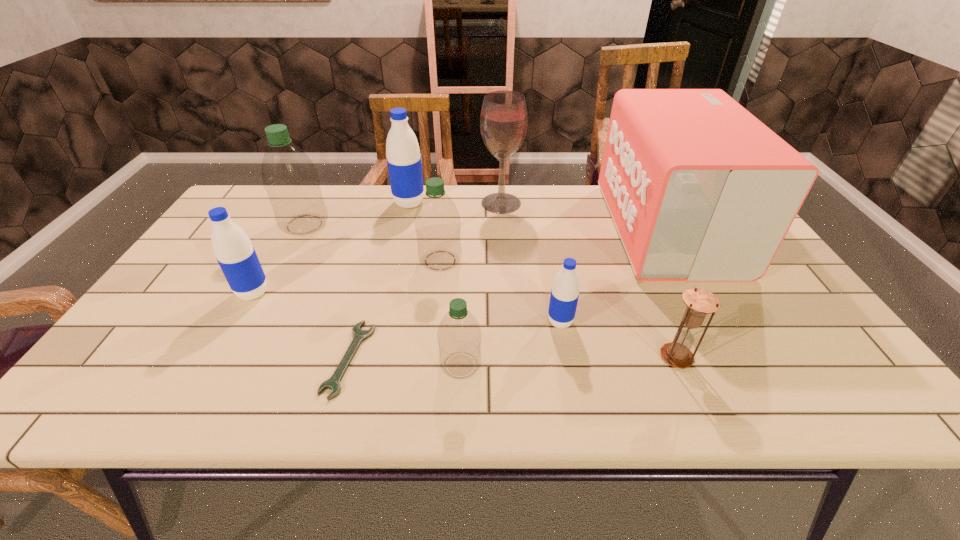
In order to click on red alcohol in this screenshot , I will do `click(504, 118)`.

This screenshot has width=960, height=540. I want to click on pink box, so point(699,189).

What are the coordinates of `the biggest blue water bottle` in the screenshot? It's located at (404, 164).

I want to click on the fourth water bottle from right to left, so click(404, 164).

Find the location of a particular element. The height and width of the screenshot is (540, 960). the farthest green water bottle is located at coordinates (290, 178).

This screenshot has height=540, width=960. I want to click on the biggest green water bottle, so click(290, 178).

You are a GUI agent. You are given a task and a screenshot of the screen. Output one action in this format:
    pyautogui.click(x=<x>, y=<y>)
    Task: Click on the second farthest green water bottle
    The image size is (960, 540).
    Given the screenshot: What is the action you would take?
    pyautogui.click(x=437, y=222)

Identify the location of the fourth nearest water bottle. The image size is (960, 540). (437, 222).

Where is `the second smallest blue water bottle`? the second smallest blue water bottle is located at coordinates (237, 258).

In order to click on the sixth farthest object in this screenshot , I will do `click(237, 258)`.